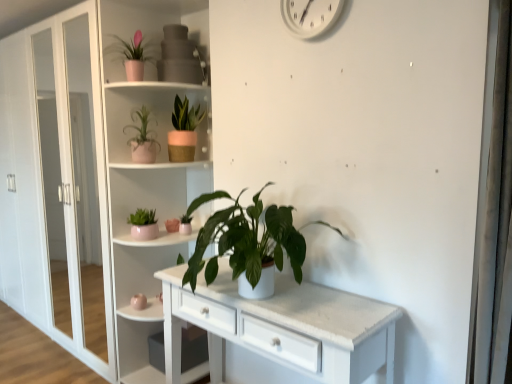
Question: Does matte pink pot at center-left, the 2th houseplant from the bottom, come in front of matte pink pot at upper left, placed as the fifth houseplant when sorted from bottom to top?

Choices:
 (A) no
 (B) yes

Answer: (A)

Question: From the image's perspective, is matte pink pot at center-left, the 2th houseplant from the bottom, above matte pink pot at upper left, placed as the fifth houseplant when sorted from bottom to top?

Choices:
 (A) no
 (B) yes

Answer: (A)

Question: Can you confirm if matte pink pot at center-left, the 2th houseplant from the bottom, is smaller than matte pink pot at upper left, marked as the 1th houseplant in a top-to-bottom arrangement?

Choices:
 (A) yes
 (B) no

Answer: (A)

Question: Is matte pink pot at upper left, placed as the fifth houseplant when sorted from bottom to top, located within matte pink pot at center-left, the 2th houseplant from the bottom?

Choices:
 (A) no
 (B) yes

Answer: (A)

Question: Is matte pink pot at center-left, which is the 4th houseplant from top to bottom, to the right of matte pink pot at upper left, placed as the fifth houseplant when sorted from bottom to top, from the viewer's perspective?

Choices:
 (A) no
 (B) yes

Answer: (B)

Question: Is matte pink pot at center-left, which is the 4th houseplant from top to bottom, shorter than matte pink pot at upper left, marked as the 1th houseplant in a top-to-bottom arrangement?

Choices:
 (A) yes
 (B) no

Answer: (A)

Question: Is matte pink vase at center shorter than matte pink pot at upper left, marked as the 1th houseplant in a top-to-bottom arrangement?

Choices:
 (A) yes
 (B) no

Answer: (A)

Question: Are matte pink vase at center and matte pink pot at upper left, marked as the 1th houseplant in a top-to-bottom arrangement, beside each other?

Choices:
 (A) no
 (B) yes

Answer: (A)

Question: Can you confirm if matte pink vase at center is taller than matte pink pot at upper left, marked as the 1th houseplant in a top-to-bottom arrangement?

Choices:
 (A) yes
 (B) no

Answer: (B)

Question: Does matte pink vase at center have a lesser width compared to matte pink pot at upper left, placed as the fifth houseplant when sorted from bottom to top?

Choices:
 (A) no
 (B) yes

Answer: (B)

Question: Does matte pink vase at center have a smaller size compared to matte pink pot at upper left, placed as the fifth houseplant when sorted from bottom to top?

Choices:
 (A) no
 (B) yes

Answer: (B)

Question: From the image's perspective, is matte pink vase at center over matte pink pot at upper left, marked as the 1th houseplant in a top-to-bottom arrangement?

Choices:
 (A) no
 (B) yes

Answer: (A)

Question: Is green matte plant at center, arranged as the fifth houseplant when viewed from the top, turned away from white plastic clock at upper center?

Choices:
 (A) no
 (B) yes

Answer: (A)